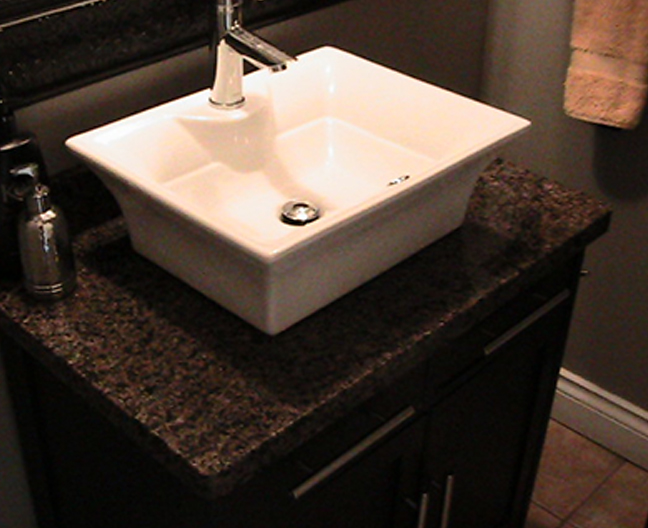
Where is `drawer`? drawer is located at coordinates point(402,385), point(481,367).